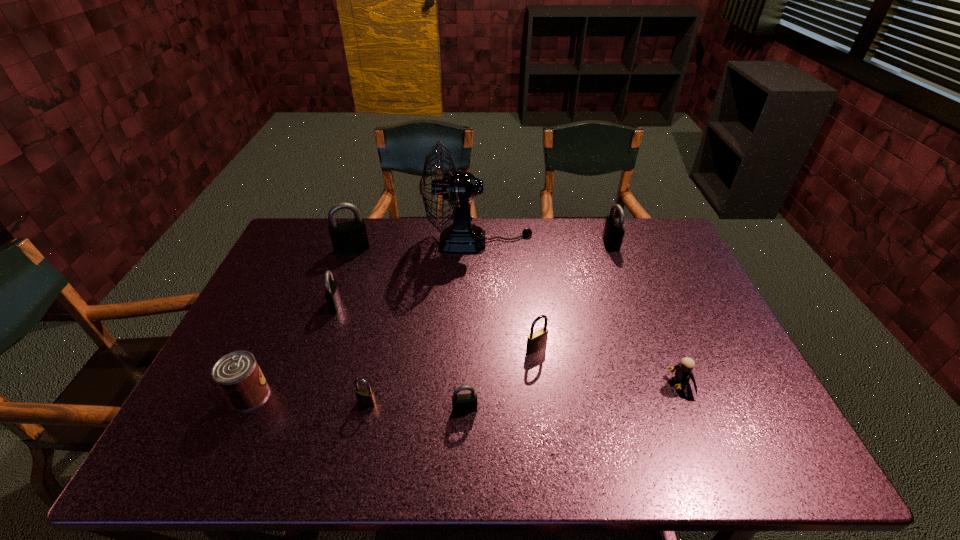
Identify the location of the leftmost object. (237, 374).

Image resolution: width=960 pixels, height=540 pixels. In order to click on Lego in this screenshot , I will do `click(683, 371)`.

I want to click on the third padlock from left to right, so click(x=364, y=396).

Find the location of a particular element. The width and height of the screenshot is (960, 540). the left brass padlock is located at coordinates pyautogui.click(x=364, y=396).

The image size is (960, 540). I want to click on the second black padlock from right to left, so 464,403.

You are a GUI agent. You are given a task and a screenshot of the screen. Output one action in this format:
    pyautogui.click(x=<x>, y=<y>)
    Task: Click on the smallest black padlock
    This screenshot has width=960, height=540.
    Given the screenshot: What is the action you would take?
    pyautogui.click(x=464, y=403)

You are a GUI agent. You are given a task and a screenshot of the screen. Output one action in this format:
    pyautogui.click(x=<x>, y=<y>)
    Task: Click on the vacant area situated in front of the fan, indicating the direction of air flow
    
    Given the screenshot: What is the action you would take?
    pyautogui.click(x=562, y=241)

Locate an element on the screen. Image resolution: width=960 pixels, height=540 pixels. vacant space located 0.380m on the front of the eighth shortest object is located at coordinates click(319, 343).

Identify the location of vacant region located 0.050m on the front of the second biggest black padlock. (617, 261).

At what (x,y) coordinates should I click in order to perform the action: click on blank space located 0.060m on the left of the third nearest padlock. Please return your answer as a coordinate pair (x, y). Looking at the image, I should click on (503, 348).